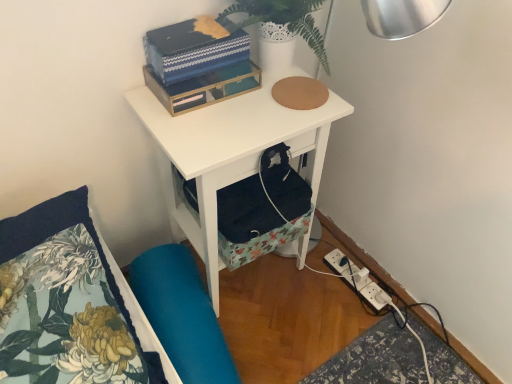
Locate an element on the screen. free area in between white plastic power strip at lower right and teal fabric swivel chair at lower left is located at coordinates (288, 313).